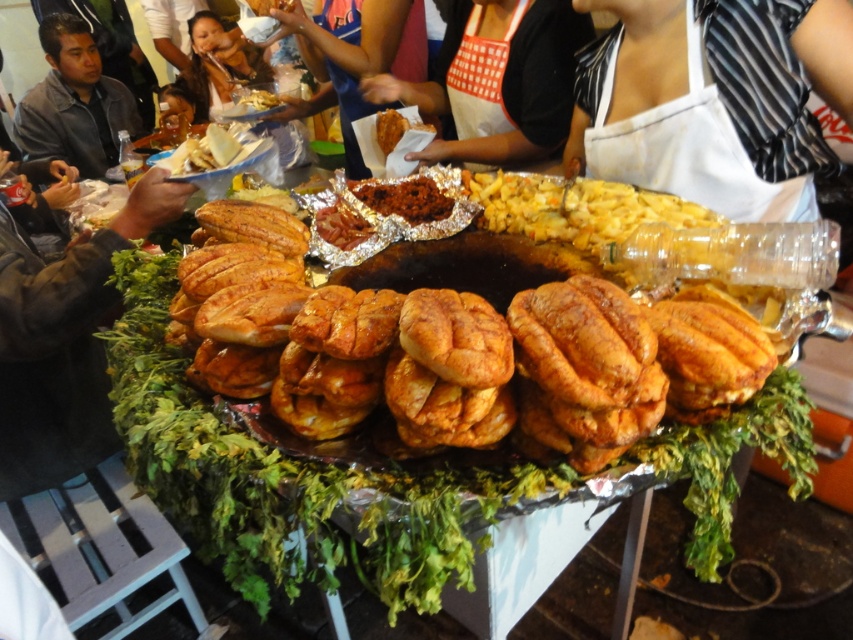
Does point (416, 326) lie in front of point (402, 131)?

Yes, it is.

Consider the image. Who is lower down, golden crispy bread at center or golden crispy chicken at center?

Positioned lower is golden crispy bread at center.

Locate an element on the screen. This screenshot has height=640, width=853. golden crispy bread at center is located at coordinates (370, 358).

This screenshot has width=853, height=640. In order to click on white apron at center in this screenshot , I will do pyautogui.click(x=498, y=81).

Does white apron at center appear under yellowish fried snack at center?

Correct, white apron at center is located below yellowish fried snack at center.

This screenshot has width=853, height=640. What are the coordinates of `white apron at center` in the screenshot? It's located at (498, 81).

Locate an element on the screen. white apron at center is located at coordinates (498, 81).

Which is more to the left, white apron at center or brown crumbly meat at center?

brown crumbly meat at center is more to the left.

Does white apron at center appear on the left side of brown crumbly meat at center?

In fact, white apron at center is to the right of brown crumbly meat at center.

What do you see at coordinates (498, 81) in the screenshot? This screenshot has width=853, height=640. I see `white apron at center` at bounding box center [498, 81].

At what (x,y) coordinates should I click in order to perform the action: click on white apron at center. Please return your answer as a coordinate pair (x, y). The height and width of the screenshot is (640, 853). Looking at the image, I should click on (498, 81).